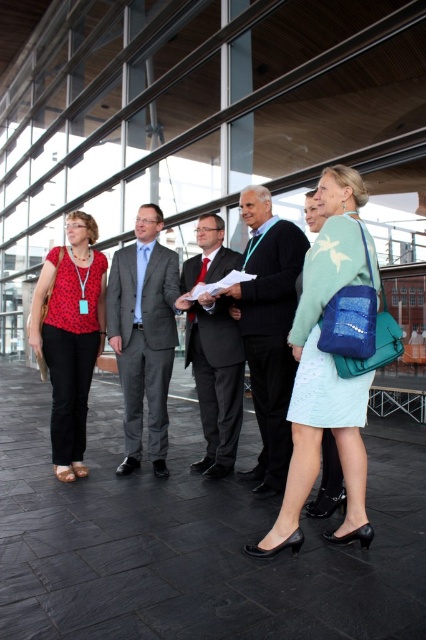
Is mint green fabric dress at center further to the viewer compared to dark gray suit at center?

No.

Looking at this image, who is more distant from viewer, (345, 282) or (238, 259)?

Positioned behind is point (238, 259).

Find the location of a particular element. This screenshot has width=426, height=640. mint green fabric dress at center is located at coordinates (325, 371).

Does gray suit at center appear under dark gray suit at center?

Incorrect, gray suit at center is not positioned below dark gray suit at center.

Who is more forward, (x=114, y=282) or (x=229, y=262)?

Point (x=229, y=262)

Locate an element on the screen. The height and width of the screenshot is (640, 426). gray suit at center is located at coordinates (143, 336).

Is mint green fabric dress at center closer to camera compared to matte red blouse at left?

That is True.

Does mint green fabric dress at center appear on the right side of matte red blouse at left?

Indeed, mint green fabric dress at center is positioned on the right side of matte red blouse at left.

The height and width of the screenshot is (640, 426). I want to click on mint green fabric dress at center, so click(x=325, y=371).